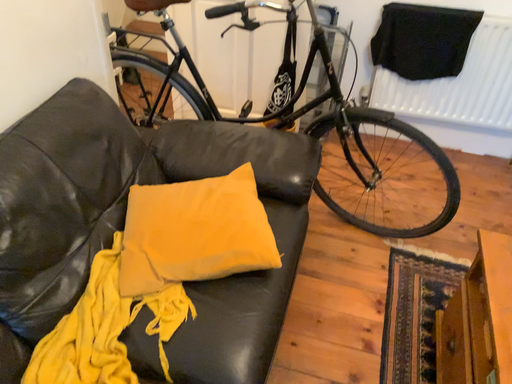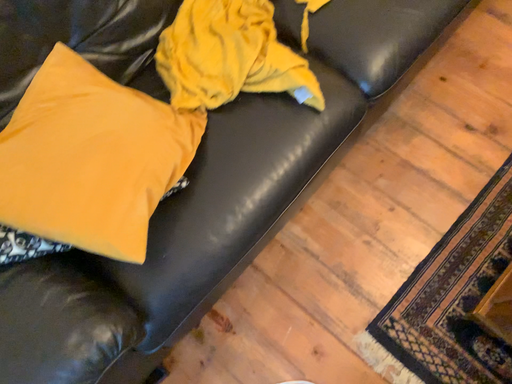
Question: Which way did the camera rotate in the video?

Choices:
 (A) rotated downward
 (B) rotated upward

Answer: (A)